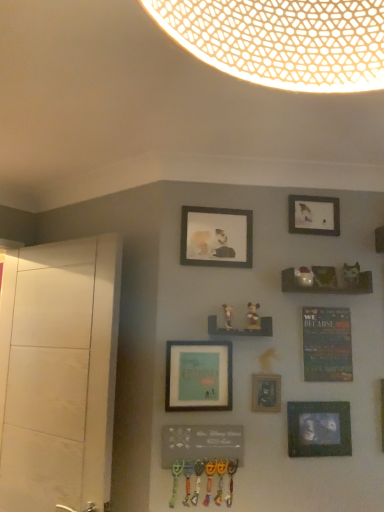
Question: Considering the relative sizes of wooden mickey mouse figurine at center, the first art from the left, and matte brown figurine at center-right, which is the second art from right to left, in the image provided, is wooden mickey mouse figurine at center, the first art from the left, thinner than matte brown figurine at center-right, which is the second art from right to left,?

Choices:
 (A) yes
 (B) no

Answer: (B)

Question: From the image's perspective, would you say wooden mickey mouse figurine at center, the first art from the left, is positioned over matte brown figurine at center-right, arranged as the second art when viewed from the left?

Choices:
 (A) yes
 (B) no

Answer: (B)

Question: From the image's perspective, would you say wooden mickey mouse figurine at center, the first art from the left, is shown under matte brown figurine at center-right, arranged as the second art when viewed from the left?

Choices:
 (A) yes
 (B) no

Answer: (A)

Question: Is wooden mickey mouse figurine at center, the 3th art when ordered from right to left, taller than matte brown figurine at center-right, which is the second art from right to left?

Choices:
 (A) no
 (B) yes

Answer: (B)

Question: Is wooden mickey mouse figurine at center, the 3th art when ordered from right to left, not within matte brown figurine at center-right, which is the second art from right to left?

Choices:
 (A) no
 (B) yes

Answer: (B)

Question: From the image's perspective, is matte black picture frame at center, which ranks as the 4th picture frame in top-to-bottom order, positioned above or below matte black picture frame at lower right, the 5th picture frame when ordered from top to bottom?

Choices:
 (A) above
 (B) below

Answer: (A)

Question: From a real-world perspective, is matte black picture frame at center, which ranks as the 4th picture frame in top-to-bottom order, above or below matte black picture frame at lower right, which is the first picture frame from bottom to top?

Choices:
 (A) below
 (B) above

Answer: (B)

Question: From their relative heights in the image, would you say matte black picture frame at center, arranged as the second picture frame when ordered from the bottom, is taller or shorter than matte black picture frame at lower right, the 5th picture frame when ordered from top to bottom?

Choices:
 (A) tall
 (B) short

Answer: (A)

Question: Do you think matte black picture frame at center, arranged as the second picture frame when ordered from the bottom, is within matte black picture frame at lower right, the 5th picture frame when ordered from top to bottom, or outside of it?

Choices:
 (A) inside
 (B) outside

Answer: (B)

Question: Based on their sizes in the image, would you say wooden mickey mouse figurine at center, the 3th art when ordered from right to left, is bigger or smaller than wooden shelf at center-right, which is the second shelf in bottom-to-top order?

Choices:
 (A) big
 (B) small

Answer: (B)

Question: Choose the correct answer: Is wooden mickey mouse figurine at center, the 3th art when ordered from right to left, inside wooden shelf at center-right, which is the second shelf in bottom-to-top order, or outside it?

Choices:
 (A) inside
 (B) outside

Answer: (B)

Question: Considering the positions of point (231, 329) and point (286, 281), is point (231, 329) closer or farther from the camera than point (286, 281)?

Choices:
 (A) farther
 (B) closer

Answer: (B)

Question: Relative to wooden shelf at center-right, acting as the second shelf starting from the left, is wooden mickey mouse figurine at center, the 3th art when ordered from right to left, in front or behind?

Choices:
 (A) behind
 (B) front

Answer: (B)

Question: In terms of size, does matte white figurine at center-right, the first art positioned from the right, appear bigger or smaller than matte black picture frame at lower right, the 5th picture frame when ordered from top to bottom?

Choices:
 (A) small
 (B) big

Answer: (A)

Question: From a real-world perspective, is matte white figurine at center-right, the first art positioned from the right, physically located above or below matte black picture frame at lower right, the 5th picture frame when ordered from top to bottom?

Choices:
 (A) above
 (B) below

Answer: (A)